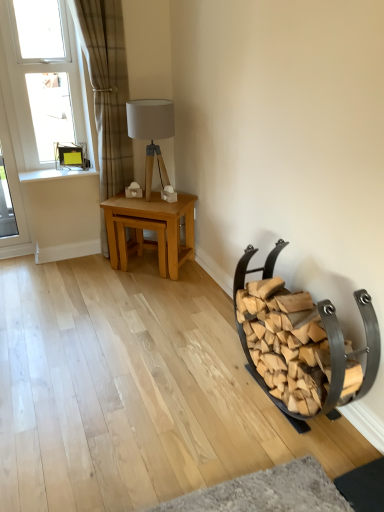
Question: Is white plastic window at upper left smaller than white wood at upper left?

Choices:
 (A) no
 (B) yes

Answer: (A)

Question: Considering the relative sizes of white plastic window at upper left and white wood at upper left in the image provided, is white plastic window at upper left taller than white wood at upper left?

Choices:
 (A) yes
 (B) no

Answer: (A)

Question: Is white plastic window at upper left wider than white wood at upper left?

Choices:
 (A) no
 (B) yes

Answer: (A)

Question: Is white plastic window at upper left further to the viewer compared to white wood at upper left?

Choices:
 (A) no
 (B) yes

Answer: (A)

Question: Can you confirm if white plastic window at upper left is positioned to the left of white wood at upper left?

Choices:
 (A) yes
 (B) no

Answer: (A)

Question: Does white plastic window at upper left appear on the right side of white wood at upper left?

Choices:
 (A) no
 (B) yes

Answer: (A)

Question: Is wooden firewood rack at lower right closer to camera compared to white plastic window at upper left?

Choices:
 (A) no
 (B) yes

Answer: (B)

Question: Is wooden firewood rack at lower right outside white plastic window at upper left?

Choices:
 (A) no
 (B) yes

Answer: (B)

Question: Considering the relative positions of wooden firewood rack at lower right and white plastic window at upper left in the image provided, is wooden firewood rack at lower right behind white plastic window at upper left?

Choices:
 (A) yes
 (B) no

Answer: (B)

Question: Is wooden firewood rack at lower right to the left of white plastic window at upper left from the viewer's perspective?

Choices:
 (A) no
 (B) yes

Answer: (A)

Question: Does wooden firewood rack at lower right have a smaller size compared to white plastic window at upper left?

Choices:
 (A) yes
 (B) no

Answer: (B)

Question: Is wooden firewood rack at lower right taller than white plastic window at upper left?

Choices:
 (A) no
 (B) yes

Answer: (A)

Question: Is wooden firewood rack at lower right positioned with its back to matte wood table lamp at center?

Choices:
 (A) no
 (B) yes

Answer: (A)